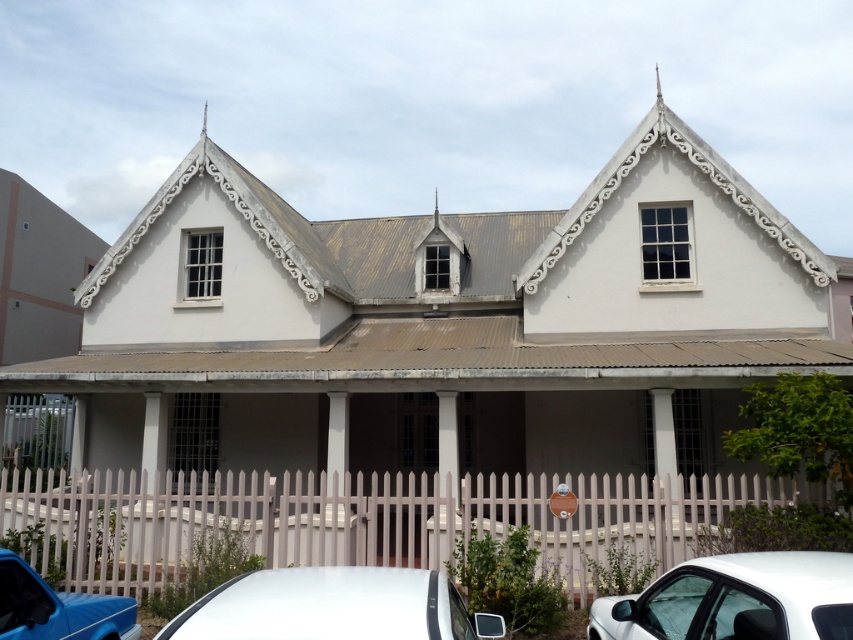
Looking at this image, you are standing in front of the two story residential building and want to park your car. There are two cars already parked in front of the building. The white matte car at lower center and the matte blue car at lower left. Which car is parked closer to the entrance of the building?

The white matte car at lower center is closer to the viewer than the matte blue car at lower left, so it is parked closer to the entrance of the building.

You are standing in front of the two story residential building and want to park your matte blue car at lower left. There is a white picket fence at lower center blocking the path. Can you drive around the fence to the right side?

The white picket fence at lower center is to the right of matte blue car at lower left, so you can drive around the fence to the right side.